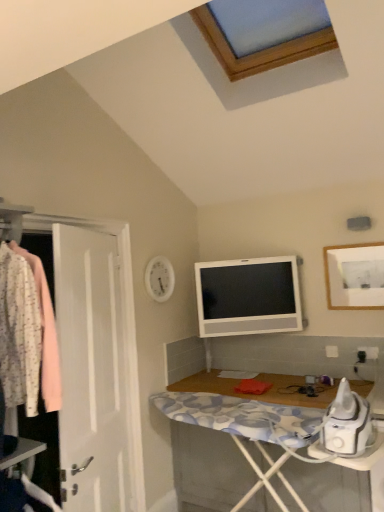
Question: Can you confirm if white wood desk at lower right is thinner than floral fabric shirt at left?

Choices:
 (A) yes
 (B) no

Answer: (B)

Question: Is white wood desk at lower right further to camera compared to floral fabric shirt at left?

Choices:
 (A) yes
 (B) no

Answer: (A)

Question: Is floral fabric shirt at left at the back of white wood desk at lower right?

Choices:
 (A) no
 (B) yes

Answer: (A)

Question: Is white wood desk at lower right bigger than floral fabric shirt at left?

Choices:
 (A) yes
 (B) no

Answer: (A)

Question: Can you confirm if white wood desk at lower right is positioned to the left of floral fabric shirt at left?

Choices:
 (A) no
 (B) yes

Answer: (A)

Question: Is floral fabric shirt at left inside white wood desk at lower right?

Choices:
 (A) yes
 (B) no

Answer: (B)

Question: Can you confirm if white glossy television at upper center is positioned to the left of white matte picture frame at upper right?

Choices:
 (A) no
 (B) yes

Answer: (B)

Question: From a real-world perspective, is white glossy television at upper center located beneath white matte picture frame at upper right?

Choices:
 (A) no
 (B) yes

Answer: (B)

Question: Is white glossy television at upper center looking in the opposite direction of white matte picture frame at upper right?

Choices:
 (A) no
 (B) yes

Answer: (A)

Question: Can you confirm if white glossy television at upper center is thinner than white matte picture frame at upper right?

Choices:
 (A) no
 (B) yes

Answer: (A)

Question: Is white glossy television at upper center with white matte picture frame at upper right?

Choices:
 (A) no
 (B) yes

Answer: (A)

Question: Can you confirm if white glossy television at upper center is shorter than white matte picture frame at upper right?

Choices:
 (A) yes
 (B) no

Answer: (B)

Question: Does white wood desk at lower right appear on the right side of white glossy television at upper center?

Choices:
 (A) yes
 (B) no

Answer: (A)